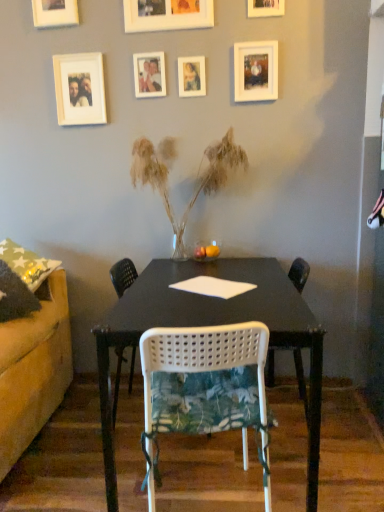
Find the location of a particular element. green floral fabric chair at center, which is counted as the second chair, starting from the back is located at coordinates (206, 387).

Measure the distance between point (112,269) and camera.

The depth of point (112,269) is 2.40 meters.

Locate an element on the screen. The width and height of the screenshot is (384, 512). white matte picture frame at upper center, placed as the 4th picture frame when sorted from left to right is located at coordinates (167, 15).

In the scene shown: Measure the distance between white matte picture frame at upper center, which appears as the sixth picture frame when viewed from the left, and camera.

white matte picture frame at upper center, which appears as the sixth picture frame when viewed from the left, and camera are 2.12 meters apart from each other.

This screenshot has height=512, width=384. What do you see at coordinates (255, 71) in the screenshot?
I see `white matte picture frame at upper center, which appears as the sixth picture frame when viewed from the left` at bounding box center [255, 71].

This screenshot has width=384, height=512. What are the coordinates of `white matte picture frame at upper left, which is the first picture frame from left to right` in the screenshot? It's located at (55, 13).

From the image's perspective, who appears lower, white matte picture frame at upper left, which appears as the seventh picture frame when viewed from the right, or white mesh chair at center, arranged as the 1th chair when viewed from the back?

white mesh chair at center, arranged as the 1th chair when viewed from the back, from the image's perspective.

From a real-world perspective, is white matte picture frame at upper left, which appears as the seventh picture frame when viewed from the right, physically above white mesh chair at center, arranged as the 1th chair when viewed from the back?

Indeed, from a real-world perspective, white matte picture frame at upper left, which appears as the seventh picture frame when viewed from the right, stands above white mesh chair at center, arranged as the 1th chair when viewed from the back.

Can you tell me how much white matte picture frame at upper left, which is the first picture frame from left to right, and white mesh chair at center, the second chair when ordered from front to back, differ in facing direction?

white matte picture frame at upper left, which is the first picture frame from left to right, and white mesh chair at center, the second chair when ordered from front to back, are facing 83.3 degrees away from each other.

Would you consider white matte picture frame at upper left, which is the first picture frame from left to right, to be distant from white mesh chair at center, the second chair when ordered from front to back?

Yes, white matte picture frame at upper left, which is the first picture frame from left to right, is far from white mesh chair at center, the second chair when ordered from front to back.

Can you confirm if green floral fabric chair at center, which is the 1th chair from front to back, is smaller than translucent glass vase with dried grass at center?

Yes, green floral fabric chair at center, which is the 1th chair from front to back, is smaller than translucent glass vase with dried grass at center.

Between green floral fabric chair at center, which is counted as the second chair, starting from the back, and translucent glass vase with dried grass at center, which one has less height?

Standing shorter between the two is green floral fabric chair at center, which is counted as the second chair, starting from the back.

Is green floral fabric chair at center, which is the 1th chair from front to back, turned away from translucent glass vase with dried grass at center?

That's not correct — green floral fabric chair at center, which is the 1th chair from front to back, is not looking away from translucent glass vase with dried grass at center.

In the scene shown: Is green floral fabric chair at center, which is counted as the second chair, starting from the back, far away from translucent glass vase with dried grass at center?

That's right, there is a large distance between green floral fabric chair at center, which is counted as the second chair, starting from the back, and translucent glass vase with dried grass at center.

Considering the positions of objects translucent glass vase with dried grass at center and white matte picture frame at upper center, the fourth picture frame positioned from the right, in the image provided, who is in front, translucent glass vase with dried grass at center or white matte picture frame at upper center, the fourth picture frame positioned from the right,?

Positioned in front is translucent glass vase with dried grass at center.

Is point (209, 191) closer or farther from the camera than point (141, 3)?

Point (209, 191) is farther from the camera than point (141, 3).

Is translucent glass vase with dried grass at center not near white matte picture frame at upper center, the fourth picture frame positioned from the right?

No, translucent glass vase with dried grass at center is in close proximity to white matte picture frame at upper center, the fourth picture frame positioned from the right.

From the image's perspective, does translucent glass vase with dried grass at center appear lower than white matte picture frame at upper center, the fourth picture frame positioned from the right?

Indeed, from the image's perspective, translucent glass vase with dried grass at center is shown beneath white matte picture frame at upper center, the fourth picture frame positioned from the right.

Is white matte picture frame at upper center, which ranks as the second picture frame in right-to-left order, next to white matte picture frame at upper center, placed as the 4th picture frame when sorted from left to right?

No, white matte picture frame at upper center, which ranks as the second picture frame in right-to-left order, is not making contact with white matte picture frame at upper center, placed as the 4th picture frame when sorted from left to right.

Is white matte picture frame at upper center, which ranks as the second picture frame in right-to-left order, completely or partially outside of white matte picture frame at upper center, placed as the 4th picture frame when sorted from left to right?

Yes, white matte picture frame at upper center, which ranks as the second picture frame in right-to-left order, is outside of white matte picture frame at upper center, placed as the 4th picture frame when sorted from left to right.

Is white matte picture frame at upper center, which ranks as the second picture frame in right-to-left order, in front of or behind white matte picture frame at upper center, the fourth picture frame positioned from the right, in the image?

Visually, white matte picture frame at upper center, which ranks as the second picture frame in right-to-left order, is located behind white matte picture frame at upper center, the fourth picture frame positioned from the right.

Is green floral fabric chair at center, which is the 1th chair from front to back, in front of or behind white matte picture frame at upper left, which ranks as the sixth picture frame in right-to-left order, in the image?

Clearly, green floral fabric chair at center, which is the 1th chair from front to back, is in front of white matte picture frame at upper left, which ranks as the sixth picture frame in right-to-left order.

Can you tell me how much green floral fabric chair at center, which is the 1th chair from front to back, and white matte picture frame at upper left, arranged as the second picture frame when viewed from the left, differ in facing direction?

171 degrees.

Which of these two, green floral fabric chair at center, which is the 1th chair from front to back, or white matte picture frame at upper left, which ranks as the sixth picture frame in right-to-left order, is bigger?

green floral fabric chair at center, which is the 1th chair from front to back.

Looking at this image, which point is more distant from viewer, (x=183, y=419) or (x=98, y=122)?

The point (x=98, y=122) is behind.

In terms of size, does matte wooden picture frame at upper center, the 3th picture frame when ordered from right to left, appear bigger or smaller than green floral fabric chair at center, which is counted as the second chair, starting from the back?

Considering their sizes, matte wooden picture frame at upper center, the 3th picture frame when ordered from right to left, takes up less space than green floral fabric chair at center, which is counted as the second chair, starting from the back.

Is the position of matte wooden picture frame at upper center, the 3th picture frame when ordered from right to left, less distant than that of green floral fabric chair at center, which is counted as the second chair, starting from the back?

No, matte wooden picture frame at upper center, the 3th picture frame when ordered from right to left, is further to the viewer.

Considering the relative positions of matte wooden picture frame at upper center, the 3th picture frame when ordered from right to left, and green floral fabric chair at center, which is counted as the second chair, starting from the back, in the image provided, is matte wooden picture frame at upper center, the 3th picture frame when ordered from right to left, to the right of green floral fabric chair at center, which is counted as the second chair, starting from the back, from the viewer's perspective?

No.

How distant is matte wooden picture frame at upper center, placed as the fifth picture frame when sorted from left to right, from green floral fabric chair at center, which is counted as the second chair, starting from the back?

matte wooden picture frame at upper center, placed as the fifth picture frame when sorted from left to right, is 5.01 feet from green floral fabric chair at center, which is counted as the second chair, starting from the back.

Considering the sizes of objects matte white photo frame at upper center, which is the 3th picture frame from left to right, and white matte picture frame at upper left, which appears as the seventh picture frame when viewed from the right, in the image provided, who is shorter, matte white photo frame at upper center, which is the 3th picture frame from left to right, or white matte picture frame at upper left, which appears as the seventh picture frame when viewed from the right,?

matte white photo frame at upper center, which is the 3th picture frame from left to right.

From the image's perspective, which object appears higher, matte white photo frame at upper center, marked as the fifth picture frame in a right-to-left arrangement, or white matte picture frame at upper left, which appears as the seventh picture frame when viewed from the right?

white matte picture frame at upper left, which appears as the seventh picture frame when viewed from the right, appears higher in the image.

Is matte white photo frame at upper center, which is the 3th picture frame from left to right, thinner than white matte picture frame at upper left, which appears as the seventh picture frame when viewed from the right?

Yes.

Is white matte picture frame at upper left, which is the first picture frame from left to right, a part of matte white photo frame at upper center, marked as the fifth picture frame in a right-to-left arrangement?

No, white matte picture frame at upper left, which is the first picture frame from left to right, is not a part of matte white photo frame at upper center, marked as the fifth picture frame in a right-to-left arrangement.

Identify the location of chair that is the 1st object located below the white matte picture frame at upper left, which appears as the seventh picture frame when viewed from the right (from the image's perspective). The height and width of the screenshot is (512, 384). (123, 276).

Find the location of a particular element. This screenshot has width=384, height=512. chair located on the right of translucent glass vase with dried grass at center is located at coordinates (206, 387).

Which object lies further to the anchor point white mesh chair at center, arranged as the 1th chair when viewed from the back, green floral fabric chair at center, which is counted as the second chair, starting from the back, or wooden picture frame at upper center, which is the 1th picture frame in right-to-left order?

wooden picture frame at upper center, which is the 1th picture frame in right-to-left order.

When comparing their distances from white mesh chair at center, arranged as the 1th chair when viewed from the back, does green floral fabric chair at center, which is the 1th chair from front to back, or white matte picture frame at upper center, which appears as the sixth picture frame when viewed from the left, seem further?

Among the two, white matte picture frame at upper center, which appears as the sixth picture frame when viewed from the left, is located further to white mesh chair at center, arranged as the 1th chair when viewed from the back.

Looking at the image, which one is located further to white matte picture frame at upper center, the fourth picture frame positioned from the right, translucent glass vase with dried grass at center or wooden picture frame at upper center, which is the 1th picture frame in right-to-left order?

translucent glass vase with dried grass at center is further to white matte picture frame at upper center, the fourth picture frame positioned from the right.

From the image, which object appears to be nearer to matte wooden picture frame at upper center, the 3th picture frame when ordered from right to left, white mesh chair at center, arranged as the 1th chair when viewed from the back, or translucent glass vase with dried grass at center?

translucent glass vase with dried grass at center is closer to matte wooden picture frame at upper center, the 3th picture frame when ordered from right to left.

From the image, which object appears to be nearer to white mesh chair at center, arranged as the 1th chair when viewed from the back, translucent glass vase with dried grass at center or white matte picture frame at upper center, which appears as the sixth picture frame when viewed from the left?

The object closer to white mesh chair at center, arranged as the 1th chair when viewed from the back, is translucent glass vase with dried grass at center.

Based on their spatial positions, is green floral fabric chair at center, which is the 1th chair from front to back, or white matte picture frame at upper center, which appears as the sixth picture frame when viewed from the left, further from white matte picture frame at upper left, which is the first picture frame from left to right?

Among the two, green floral fabric chair at center, which is the 1th chair from front to back, is located further to white matte picture frame at upper left, which is the first picture frame from left to right.

Looking at the image, which one is located further to white mesh chair at center, the second chair when ordered from front to back, white matte picture frame at upper center, which ranks as the second picture frame in right-to-left order, or white matte picture frame at upper left, arranged as the second picture frame when viewed from the left?

The object further to white mesh chair at center, the second chair when ordered from front to back, is white matte picture frame at upper center, which ranks as the second picture frame in right-to-left order.

Based on their spatial positions, is white matte picture frame at upper center, placed as the 4th picture frame when sorted from left to right, or green floral fabric chair at center, which is counted as the second chair, starting from the back, closer to white mesh chair at center, arranged as the 1th chair when viewed from the back?

green floral fabric chair at center, which is counted as the second chair, starting from the back, lies closer to white mesh chair at center, arranged as the 1th chair when viewed from the back, than the other object.

Find the location of `chair between white matte picture frame at upper left, which ranks as the sixth picture frame in right-to-left order, and green floral fabric chair at center, which is counted as the second chair, starting from the back, in the vertical direction`. chair between white matte picture frame at upper left, which ranks as the sixth picture frame in right-to-left order, and green floral fabric chair at center, which is counted as the second chair, starting from the back, in the vertical direction is located at coordinates (123, 276).

Where is `houseplant between matte wooden picture frame at upper center, placed as the fifth picture frame when sorted from left to right, and white mesh chair at center, arranged as the 1th chair when viewed from the back, in the vertical direction`? The image size is (384, 512). houseplant between matte wooden picture frame at upper center, placed as the fifth picture frame when sorted from left to right, and white mesh chair at center, arranged as the 1th chair when viewed from the back, in the vertical direction is located at coordinates (198, 182).

Find the location of a particular element. The height and width of the screenshot is (512, 384). houseplant between white matte picture frame at upper left, which ranks as the sixth picture frame in right-to-left order, and white matte picture frame at upper center, which appears as the sixth picture frame when viewed from the left, from left to right is located at coordinates (198, 182).

Where is `houseplant between white matte picture frame at upper center, placed as the 4th picture frame when sorted from left to right, and white mesh chair at center, arranged as the 1th chair when viewed from the back, in the up-down direction`? This screenshot has width=384, height=512. houseplant between white matte picture frame at upper center, placed as the 4th picture frame when sorted from left to right, and white mesh chair at center, arranged as the 1th chair when viewed from the back, in the up-down direction is located at coordinates (198, 182).